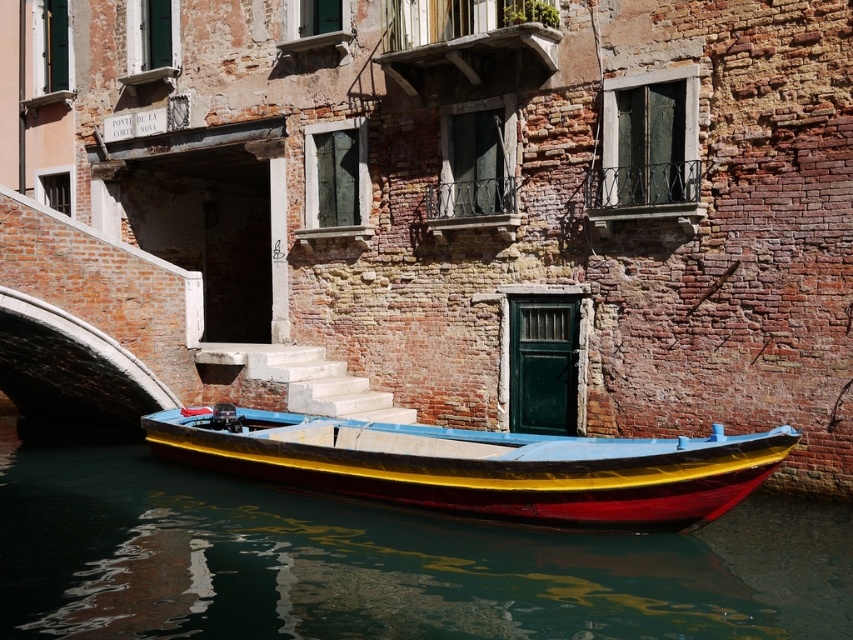
Question: Which point appears closest to the camera in this image?

Choices:
 (A) (546, 621)
 (B) (543, 483)

Answer: (A)

Question: Can you confirm if smooth water at boat center is wider than shiny wood boat at center?

Choices:
 (A) no
 (B) yes

Answer: (B)

Question: Is smooth water at boat center positioned in front of shiny wood boat at center?

Choices:
 (A) yes
 (B) no

Answer: (A)

Question: Can you confirm if smooth water at boat center is smaller than shiny wood boat at center?

Choices:
 (A) yes
 (B) no

Answer: (B)

Question: Among these objects, which one is nearest to the camera?

Choices:
 (A) shiny wood boat at center
 (B) smooth water at boat center

Answer: (B)